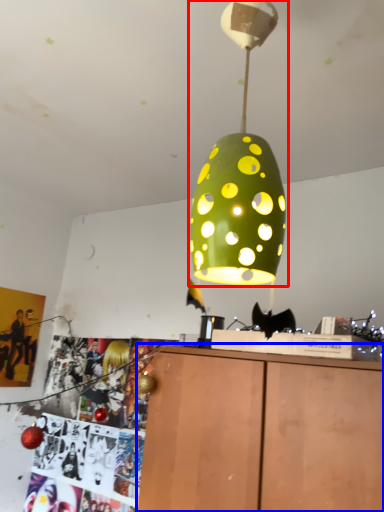
Question: Which point is further to the camera, lamp (highlighted by a red box) or furniture (highlighted by a blue box)?

Choices:
 (A) lamp
 (B) furniture

Answer: (B)